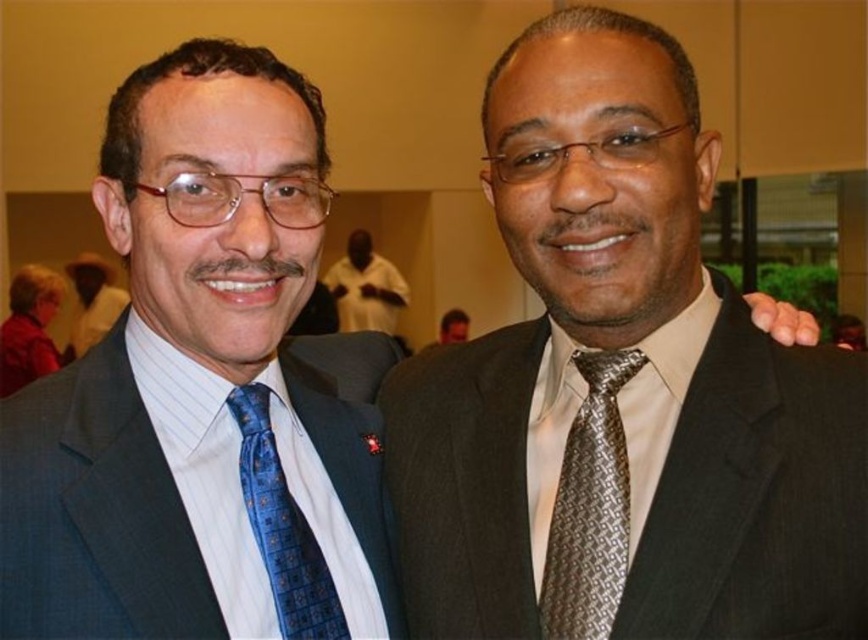
Which is in front, point (251, 520) or point (392, 332)?

Point (251, 520)

Is blue dotted fabric tie at left shorter than white matte shirt at center?

Yes, blue dotted fabric tie at left is shorter than white matte shirt at center.

The width and height of the screenshot is (868, 640). Describe the element at coordinates (281, 528) in the screenshot. I see `blue dotted fabric tie at left` at that location.

The image size is (868, 640). Identify the location of blue dotted fabric tie at left. (281, 528).

This screenshot has height=640, width=868. Describe the element at coordinates (625, 381) in the screenshot. I see `matte black suit at center` at that location.

Find the location of a particular element. The image size is (868, 640). matte black suit at center is located at coordinates (625, 381).

Which is behind, point (330, 289) or point (64, 355)?

The point (330, 289) is behind.

Does white matte shirt at center have a greater height compared to blue satin tie at left?

Yes.

Identify the location of white matte shirt at center. (365, 288).